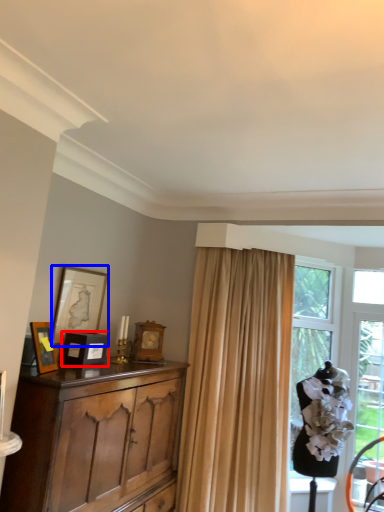
Question: Which point is further to the camera, picture frame (highlighted by a red box) or picture frame (highlighted by a blue box)?

Choices:
 (A) picture frame
 (B) picture frame

Answer: (B)